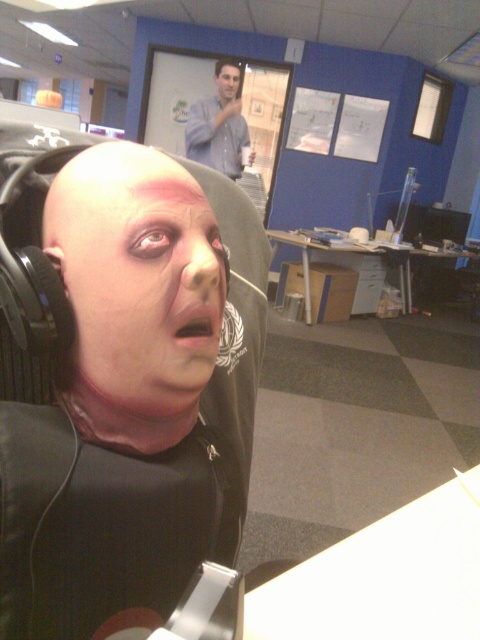
Is matte black face at center bigger than blue shirt at upper center?

No, matte black face at center is not bigger than blue shirt at upper center.

Can you confirm if matte black face at center is shorter than blue shirt at upper center?

Indeed, matte black face at center has a lesser height compared to blue shirt at upper center.

Between point (196, 236) and point (237, 152), which one is positioned in front?

Positioned in front is point (196, 236).

I want to click on matte black face at center, so click(137, 276).

Is matte black face at center taller than matte black head at upper center?

No, matte black face at center is not taller than matte black head at upper center.

Find the location of a particular element. matte black face at center is located at coordinates (x=137, y=276).

The image size is (480, 640). Find the location of `matte black face at center`. matte black face at center is located at coordinates (137, 276).

Is point (235, 294) positioned before point (206, 134)?

Yes, point (235, 294) is closer to viewer.

Between matte black mask at center and blue shirt at upper center, which one has less height?

With less height is matte black mask at center.

Where is `matte black mask at center`? The height and width of the screenshot is (640, 480). matte black mask at center is located at coordinates (134, 396).